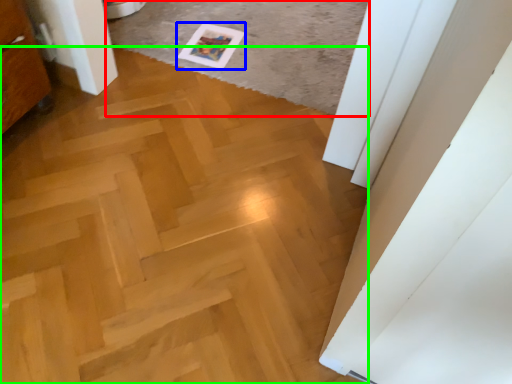
Question: Which object is the closest to the plain (highlighted by a red box)? Choose among these: postcard (highlighted by a blue box) or plywood (highlighted by a green box).

Choices:
 (A) postcard
 (B) plywood

Answer: (A)